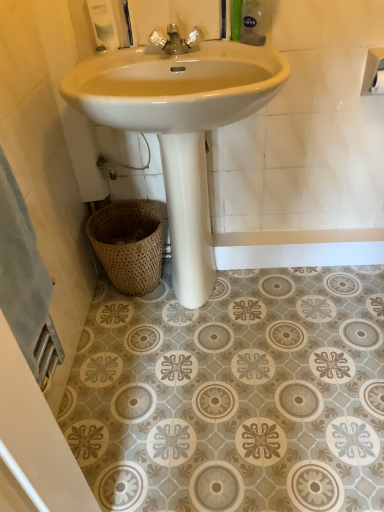
What are the coordinates of `free space to the left of green plastic bottle at upper right, the second toiletry when ordered from left to right` in the screenshot? It's located at point(219,50).